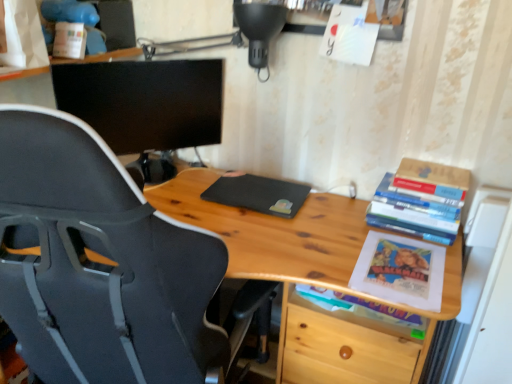
Describe the element at coordinates (360, 307) in the screenshot. I see `matte paper book at lower right, the third book viewed from the top` at that location.

What do you see at coordinates (145, 101) in the screenshot?
I see `black matte monitor at upper left` at bounding box center [145, 101].

Identify the location of black plastic chair at left. The height and width of the screenshot is (384, 512). (100, 264).

In order to face black matte laptop at center, should I rotate leftwards or rightwards?

To align with it, rotate right about 0.557°.

What is the approximate height of wooden table at right?

29.95 inches.

Locate an element on the screen. hardcover book at upper right, acting as the 1th book starting from the top is located at coordinates (416, 192).

Considering the relative sizes of black matte monitor at upper left and wooden table at right in the image provided, is black matte monitor at upper left wider than wooden table at right?

In fact, black matte monitor at upper left might be narrower than wooden table at right.

Is wooden table at right at the back of black matte monitor at upper left?

black matte monitor at upper left is not turned away from wooden table at right.

Between black matte monitor at upper left and wooden table at right, which one is positioned in front?

wooden table at right.

Where is `computer monitor on the left of wooden table at right`? The image size is (512, 384). computer monitor on the left of wooden table at right is located at coordinates (145, 101).

Where is `book that is the 3rd object located above the wooden table at right (from the image's perspective)`? Image resolution: width=512 pixels, height=384 pixels. book that is the 3rd object located above the wooden table at right (from the image's perspective) is located at coordinates (416, 192).

Is hardcover book at upper right, which is the 3th book in bottom-to-top order, positioned before wooden table at right?

No, the depth of hardcover book at upper right, which is the 3th book in bottom-to-top order, is greater than that of wooden table at right.

Does point (454, 200) come in front of point (332, 252)?

No.

Which object is positioned more to the left, hardcover book at upper right, acting as the 1th book starting from the top, or wooden table at right?

From the viewer's perspective, wooden table at right appears more on the left side.

In the scene shown: Considering the relative sizes of matte paper book at lower right, the first book from the bottom, and wooden table at right in the image provided, is matte paper book at lower right, the first book from the bottom, wider than wooden table at right?

In fact, matte paper book at lower right, the first book from the bottom, might be narrower than wooden table at right.

Do you think matte paper book at lower right, the third book viewed from the top, is within wooden table at right, or outside of it?

The correct answer is: inside.

From the picture: Is matte paper book at lower right, the first book from the bottom, facing away from wooden table at right?

That's right, matte paper book at lower right, the first book from the bottom, is facing away from wooden table at right.

Considering the positions of objects matte paper book at lower right, the third book viewed from the top, and wooden table at right in the image provided, who is more to the left, matte paper book at lower right, the third book viewed from the top, or wooden table at right?

wooden table at right is more to the left.

Would you consider black matte laptop at center to be distant from black plastic chair at left?

No.

Is black matte laptop at center closer to camera compared to black plastic chair at left?

No, the depth of black matte laptop at center is greater than that of black plastic chair at left.

Considering the positions of point (283, 192) and point (40, 197), is point (283, 192) closer or farther from the camera than point (40, 197)?

Point (283, 192) is positioned farther from the camera compared to point (40, 197).

Can you see black matte monitor at upper left touching black matte laptop at center?

No, black matte monitor at upper left is not next to black matte laptop at center.

From the image's perspective, is black matte monitor at upper left beneath black matte laptop at center?

No.

Can you tell me how much black matte monitor at upper left and black matte laptop at center differ in facing direction?

The angle between the facing direction of black matte monitor at upper left and the facing direction of black matte laptop at center is 47.1 degrees.

From the image's perspective, is hardcover book at upper right, which is the 3th book in bottom-to-top order, positioned above or below black matte laptop at center?

From the image's perspective, hardcover book at upper right, which is the 3th book in bottom-to-top order, appears above black matte laptop at center.

Considering the relative sizes of hardcover book at upper right, acting as the 1th book starting from the top, and black matte laptop at center in the image provided, is hardcover book at upper right, acting as the 1th book starting from the top, smaller than black matte laptop at center?

Yes, hardcover book at upper right, acting as the 1th book starting from the top, is smaller than black matte laptop at center.

How different are the orientations of hardcover book at upper right, which is the 3th book in bottom-to-top order, and black matte laptop at center in degrees?

They differ by 3.4 degrees in their facing directions.

Is hardcover book at upper right, which is the 3th book in bottom-to-top order, positioned behind black matte laptop at center?

That is False.

Is hardcover books at right, which appears as the second book when ordered from the bottom, facing towards hardcover book at upper right, acting as the 1th book starting from the top?

No, hardcover books at right, which appears as the second book when ordered from the bottom, is not oriented towards hardcover book at upper right, acting as the 1th book starting from the top.

Which point is more distant from viewer, [457,184] or [457,200]?

The point [457,184] is farther.

Is the depth of hardcover books at right, which appears as the second book when ordered from the bottom, less than that of hardcover book at upper right, which is the 3th book in bottom-to-top order?

That is True.

Where is `table located below the black matte monitor at upper left (from the image's perspective)`? This screenshot has height=384, width=512. table located below the black matte monitor at upper left (from the image's perspective) is located at coordinates (273, 235).

You are a GUI agent. You are given a task and a screenshot of the screen. Output one action in this format:
    pyautogui.click(x=<x>, y=<y>)
    Task: Click on the table in front of the hardcover book at upper right, which is the 3th book in bottom-to-top order
    
    Given the screenshot: What is the action you would take?
    click(x=273, y=235)

When comparing their distances from hardcover book at upper right, acting as the 1th book starting from the top, does black matte laptop at center or black plastic chair at left seem further?

black plastic chair at left is further to hardcover book at upper right, acting as the 1th book starting from the top.

From the image, which object appears to be farther from wooden table at right, black matte monitor at upper left or matte paper book at lower right, the third book viewed from the top?

black matte monitor at upper left is further to wooden table at right.

Considering their positions, is black matte monitor at upper left positioned further to wooden table at right than black plastic chair at left?

black matte monitor at upper left is positioned further to the anchor wooden table at right.

Which object lies nearer to the anchor point hardcover books at right, which appears as the 2th book when viewed from the top, wooden table at right or black matte monitor at upper left?

Among the two, wooden table at right is located nearer to hardcover books at right, which appears as the 2th book when viewed from the top.

Looking at the image, which one is located closer to wooden table at right, hardcover books at right, which appears as the second book when ordered from the bottom, or black matte monitor at upper left?

Based on the image, hardcover books at right, which appears as the second book when ordered from the bottom, appears to be nearer to wooden table at right.

Estimate the real-world distances between objects in this image. Which object is further from wooden table at right, hardcover book at upper right, acting as the 1th book starting from the top, or hardcover books at right, which appears as the second book when ordered from the bottom?

hardcover book at upper right, acting as the 1th book starting from the top, is further to wooden table at right.

From the image, which object appears to be nearer to hardcover book at upper right, which is the 3th book in bottom-to-top order, black plastic chair at left or black matte monitor at upper left?

black matte monitor at upper left lies closer to hardcover book at upper right, which is the 3th book in bottom-to-top order, than the other object.

Looking at the image, which one is located closer to hardcover books at right, which appears as the 2th book when viewed from the top, black matte monitor at upper left or matte paper book at lower right, the third book viewed from the top?

The object closer to hardcover books at right, which appears as the 2th book when viewed from the top, is matte paper book at lower right, the third book viewed from the top.

Locate an element on the screen. chair between black matte monitor at upper left and hardcover books at right, which appears as the second book when ordered from the bottom is located at coordinates (100, 264).

Locate an element on the screen. computer monitor between black plastic chair at left and black matte laptop at center along the z-axis is located at coordinates (145, 101).

Find the location of a particular element. The width and height of the screenshot is (512, 384). table between black plastic chair at left and hardcover book at upper right, acting as the 1th book starting from the top, from left to right is located at coordinates (273, 235).

You are a GUI agent. You are given a task and a screenshot of the screen. Output one action in this format:
    pyautogui.click(x=<x>, y=<y>)
    Task: Click on the book between hardcover book at upper right, acting as the 1th book starting from the top, and matte paper book at lower right, the third book viewed from the top, in the up-down direction
    
    Given the screenshot: What is the action you would take?
    pyautogui.click(x=421, y=201)